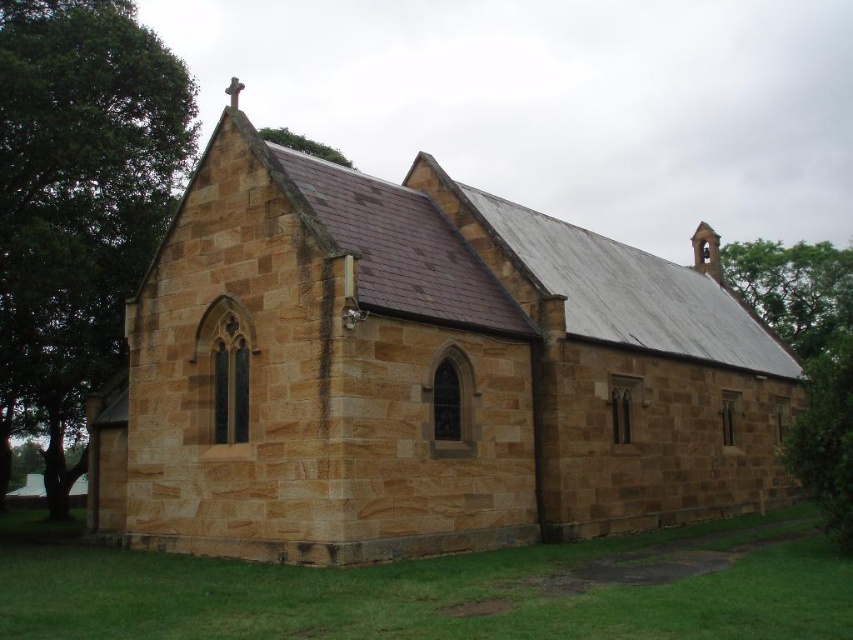
You are standing in a field and see the brown stone church at center and the green leafy tree at upper center. Which object is closer to you?

The brown stone church at center is closer to the viewer than the green leafy tree at upper center.

You are standing in front of the church and want to take a photo that includes both the green leafy tree at upper right and the green leafy tree at upper center. Which tree should you position to your left to ensure both are in the frame?

You should position the green leafy tree at upper center to your left because the green leafy tree at upper right is to the right of it, so placing the green leafy tree at upper center to your left will keep both trees within the frame.

You are a photographer planning to capture the brown stone church at center and the green leafy tree at left in a single wide shot. Based on their sizes, which object should you position closer to the camera to make them appear more balanced in the frame?

The brown stone church at center is larger in size than the green leafy tree at left, so to balance their sizes in the frame, you should position the green leafy tree at left closer to the camera while keeping the brown stone church at center farther away.